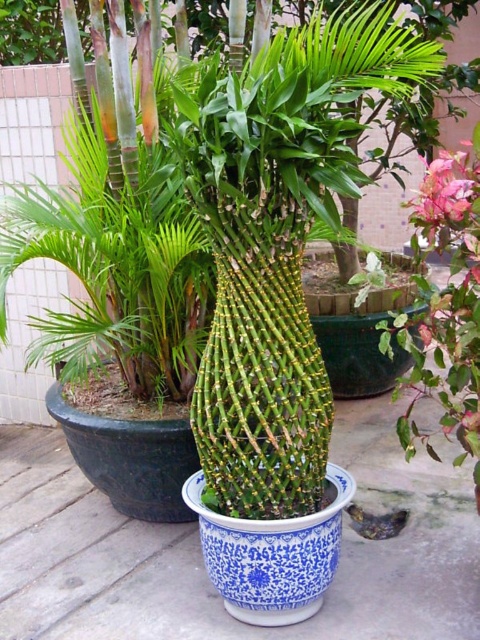
Question: Among these objects, which one is farthest from the camera?

Choices:
 (A) blue porcelain vase at center
 (B) pink matte flower at upper right

Answer: (A)

Question: Observing the image, what is the correct spatial positioning of blue porcelain vase at center in reference to pink matte flower at upper right?

Choices:
 (A) right
 (B) left

Answer: (B)

Question: Is blue porcelain vase at center above pink matte flower at upper right?

Choices:
 (A) yes
 (B) no

Answer: (B)

Question: Considering the relative positions of blue porcelain vase at center and pink matte flower at upper right in the image provided, where is blue porcelain vase at center located with respect to pink matte flower at upper right?

Choices:
 (A) left
 (B) right

Answer: (A)

Question: Which of the following is the closest to the observer?

Choices:
 (A) pink matte flower at upper right
 (B) blue porcelain vase at center

Answer: (A)